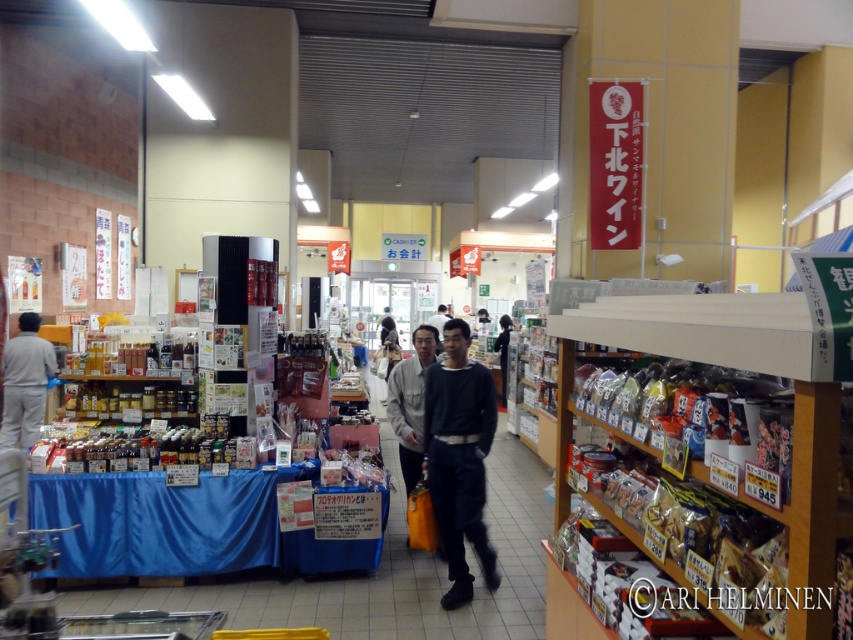
Question: Is dark blue sweater at center behind gray matte clothing at left?

Choices:
 (A) yes
 (B) no

Answer: (B)

Question: Considering the relative positions of dark blue sweater at center and gray matte clothing at left in the image provided, where is dark blue sweater at center located with respect to gray matte clothing at left?

Choices:
 (A) above
 (B) below

Answer: (B)

Question: Among these objects, which one is farthest from the camera?

Choices:
 (A) gray matte clothing at left
 (B) dark gray sweater at center

Answer: (A)

Question: Estimate the real-world distances between objects in this image. Which object is farther from the gray matte clothing at left?

Choices:
 (A) dark gray sweater at center
 (B) dark blue sweater at center

Answer: (A)

Question: Does dark blue sweater at center have a larger size compared to gray matte clothing at left?

Choices:
 (A) no
 (B) yes

Answer: (B)

Question: Which object is farther from the camera taking this photo?

Choices:
 (A) dark blue sweater at center
 (B) dark gray sweater at center
 (C) gray matte clothing at left

Answer: (C)